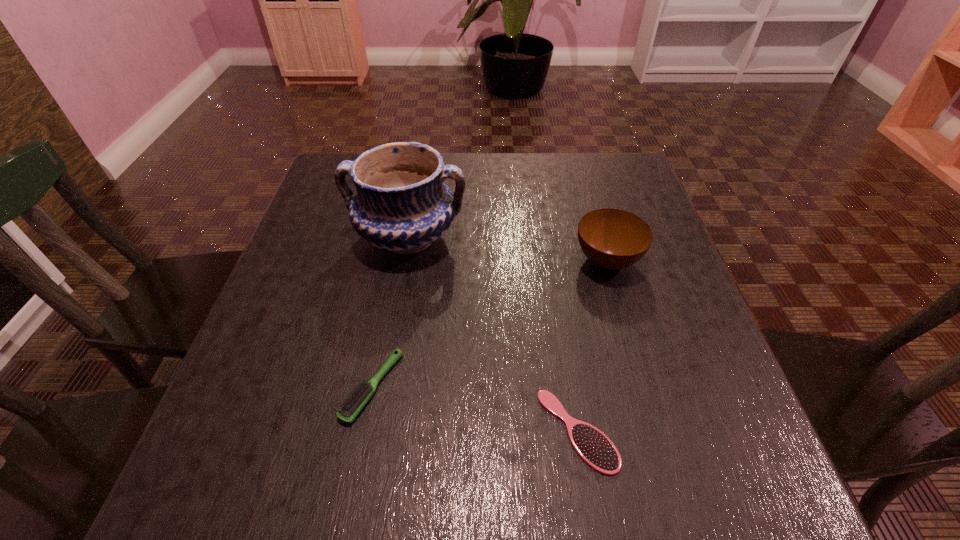
Where is `object located in the near edge section of the desktop`? This screenshot has height=540, width=960. object located in the near edge section of the desktop is located at coordinates (596, 449).

What are the coordinates of `object present at the left edge` in the screenshot? It's located at (402, 205).

I want to click on object located at the right edge, so [611, 238].

Identify the location of free space at the far edge. The width and height of the screenshot is (960, 540). (560, 187).

Where is `blank space at the left edge of the desktop`? blank space at the left edge of the desktop is located at coordinates (271, 321).

This screenshot has width=960, height=540. Identify the location of vacant space at the right edge of the desktop. (678, 300).

Where is `free point between the pottery and the shortest object`? This screenshot has height=540, width=960. free point between the pottery and the shortest object is located at coordinates (492, 334).

Locate an element on the screen. The height and width of the screenshot is (540, 960). vacant area between the bowl and the left hairbrush is located at coordinates (490, 323).

Locate an element on the screen. vacant region between the left hairbrush and the second tallest object is located at coordinates (490, 323).

At what (x,y) coordinates should I click in order to perform the action: click on free space between the left hairbrush and the shorter hairbrush. Please return your answer as a coordinate pair (x, y). Image resolution: width=960 pixels, height=540 pixels. Looking at the image, I should click on (475, 409).